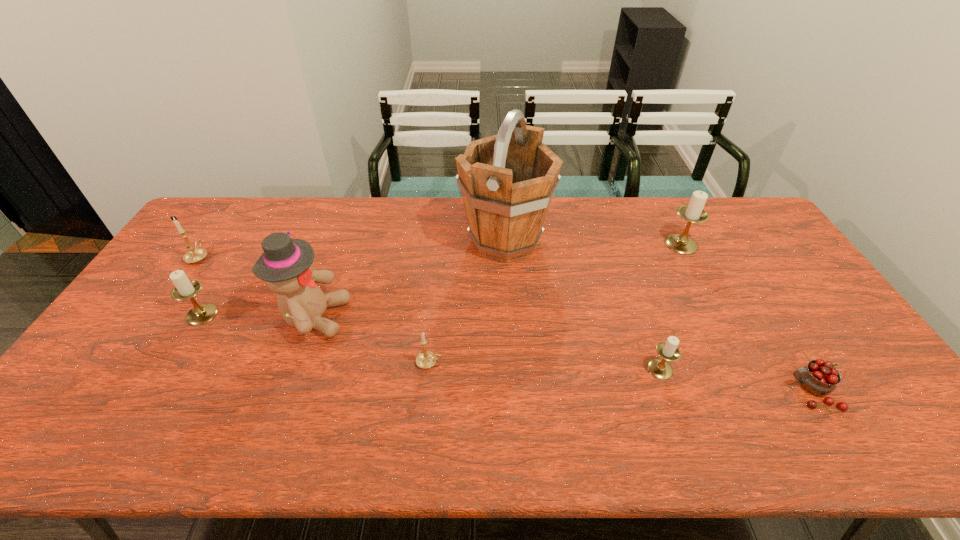
Locate an element on the screen. The width and height of the screenshot is (960, 540). unoccupied position between the second nearest white candle holder and the sixth object from right to left is located at coordinates (258, 316).

Find the location of `free space that is in between the nearest white candle holder and the rag_doll`. free space that is in between the nearest white candle holder and the rag_doll is located at coordinates (487, 343).

Where is `free spot between the right gold candle holder and the rightmost object`? Image resolution: width=960 pixels, height=540 pixels. free spot between the right gold candle holder and the rightmost object is located at coordinates point(621,377).

This screenshot has height=540, width=960. I want to click on vacant space that's between the nearer gold candle holder and the fourth object from right to left, so click(x=468, y=302).

At what (x,y) coordinates should I click in order to perform the action: click on the third closest object relative to the tallest candle holder. Please return your answer as a coordinate pair (x, y). Looking at the image, I should click on (819, 377).

The width and height of the screenshot is (960, 540). I want to click on object that stands as the sixth closest to the right gold candle holder, so click(x=693, y=213).

Select which candle holder is the closest to the left gold candle holder. Please provide its 2D coordinates. Your answer should be formatted as a tuple, i.e. [(x, y)], where the tuple contains the x and y coordinates of a point satisfying the conditions above.

[(184, 288)]

At what (x,y) coordinates should I click in order to perform the action: click on candle holder that stands as the fourth closest to the fourth object from left to right. Please return your answer as a coordinate pair (x, y). This screenshot has height=540, width=960. Looking at the image, I should click on (693, 213).

Identify which white candle holder is the closest to the rightmost candle holder. Please provide its 2D coordinates. Your answer should be formatted as a tuple, i.e. [(x, y)], where the tuple contains the x and y coordinates of a point satisfying the conditions above.

[(659, 368)]

Where is `white candle holder that is the second closest to the sixth object from left to right`? white candle holder that is the second closest to the sixth object from left to right is located at coordinates (184, 288).